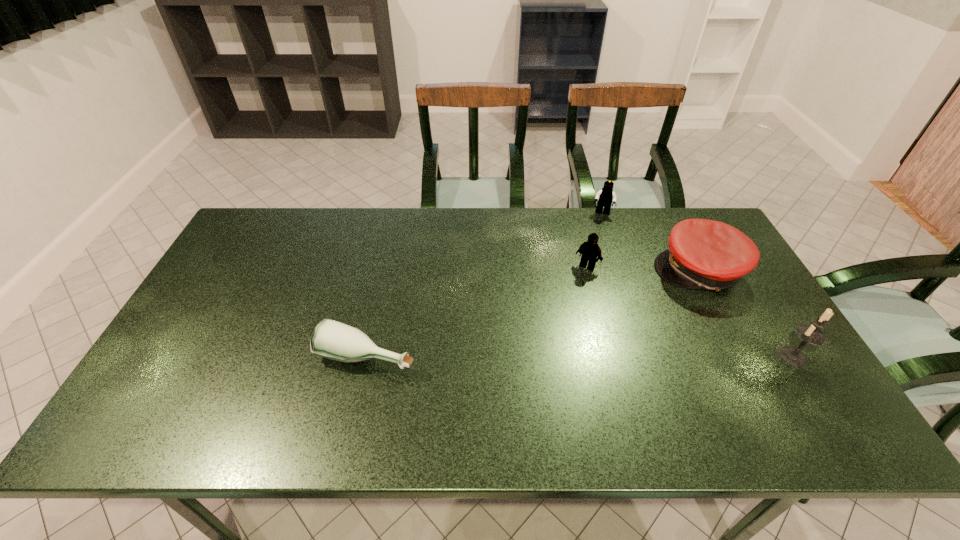
This screenshot has width=960, height=540. Identify the location of the shortest object. (333, 340).

At what (x,y) coordinates should I click in order to perform the action: click on the leftmost object. Please return your answer as a coordinate pair (x, y). This screenshot has width=960, height=540. Looking at the image, I should click on (333, 340).

Identify the location of candle holder. (811, 334).

Where is `cap`? The image size is (960, 540). cap is located at coordinates (703, 254).

Find the location of a particular element. the second object from left to right is located at coordinates (590, 250).

Image resolution: width=960 pixels, height=540 pixels. I want to click on the left Lego, so click(x=590, y=250).

Image resolution: width=960 pixels, height=540 pixels. Identify the location of the farther Lego. pyautogui.click(x=605, y=197).

Find the location of a particular element. The image size is (960, 540). the third object from left to right is located at coordinates (605, 197).

This screenshot has width=960, height=540. I want to click on free space located 0.330m on the right of the bottle, so click(x=546, y=356).

Identify the location of free space located 0.320m on the back of the tallest object. (735, 262).